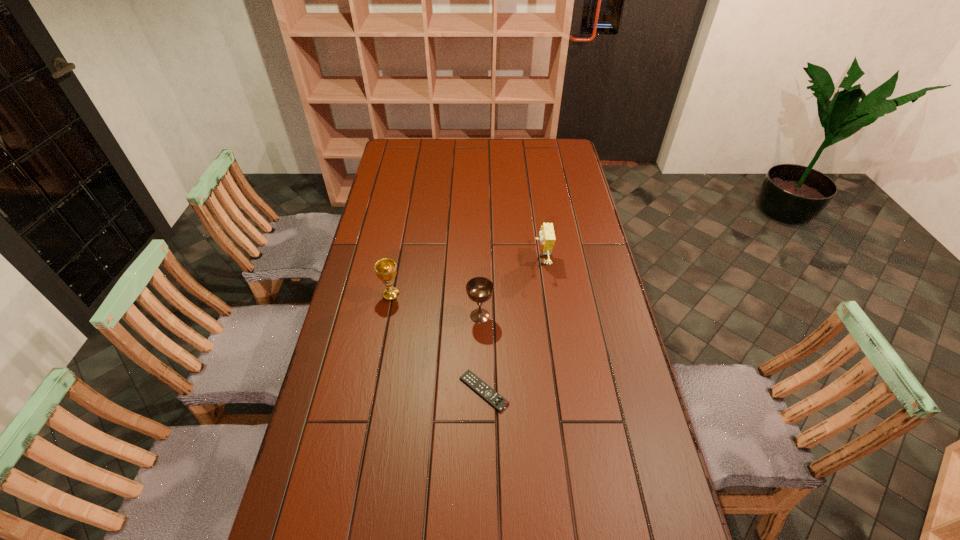
I want to click on the rightmost object, so click(547, 238).

Where is `the farthest object`? The height and width of the screenshot is (540, 960). the farthest object is located at coordinates (547, 238).

Where is `the left chalice`? the left chalice is located at coordinates click(x=385, y=268).

The image size is (960, 540). I want to click on the leftmost object, so click(x=385, y=268).

Where is `the nearer chalice`? The height and width of the screenshot is (540, 960). the nearer chalice is located at coordinates (479, 289).

The height and width of the screenshot is (540, 960). I want to click on the right chalice, so click(479, 289).

Find the location of a particular element. The image size is (960, 540). the shortest object is located at coordinates (x=469, y=378).

The image size is (960, 540). What are the coordinates of `the nearest object` in the screenshot? It's located at (469, 378).

Find the location of a particular element. free space located on the face of the farthest object is located at coordinates (501, 261).

Find the location of a particular element. The width and height of the screenshot is (960, 540). vacant space located 0.060m on the face of the farthest object is located at coordinates (516, 261).